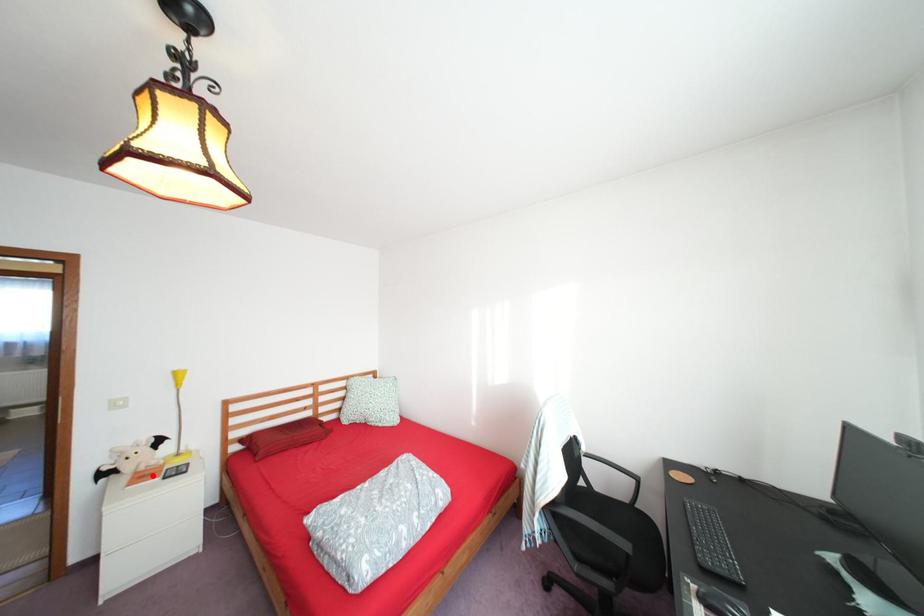
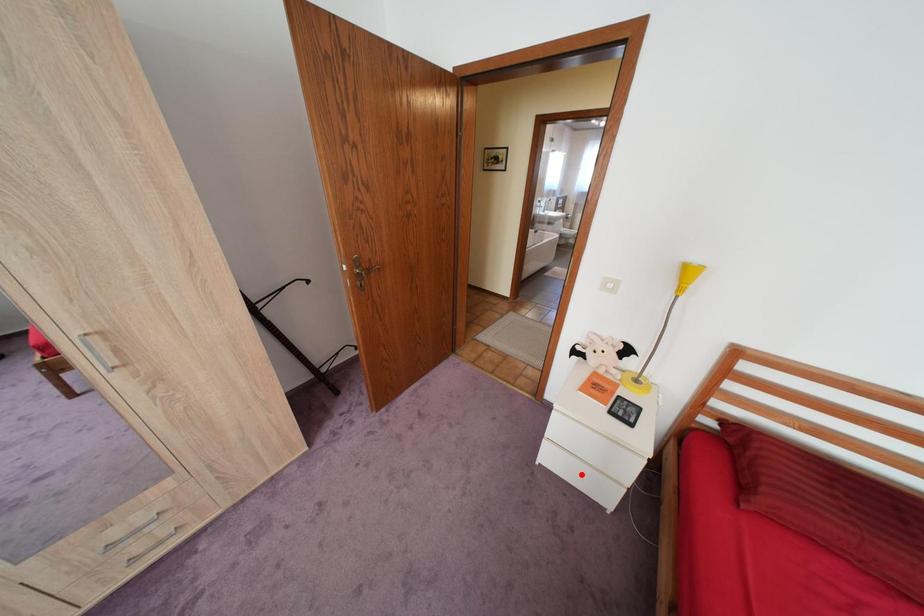
I am providing you with two images of the same scene from different viewpoints. A red point is marked on the first image and another point is marked on the second image. Are the points marked in image1 and image2 representing the same 3D position?

No